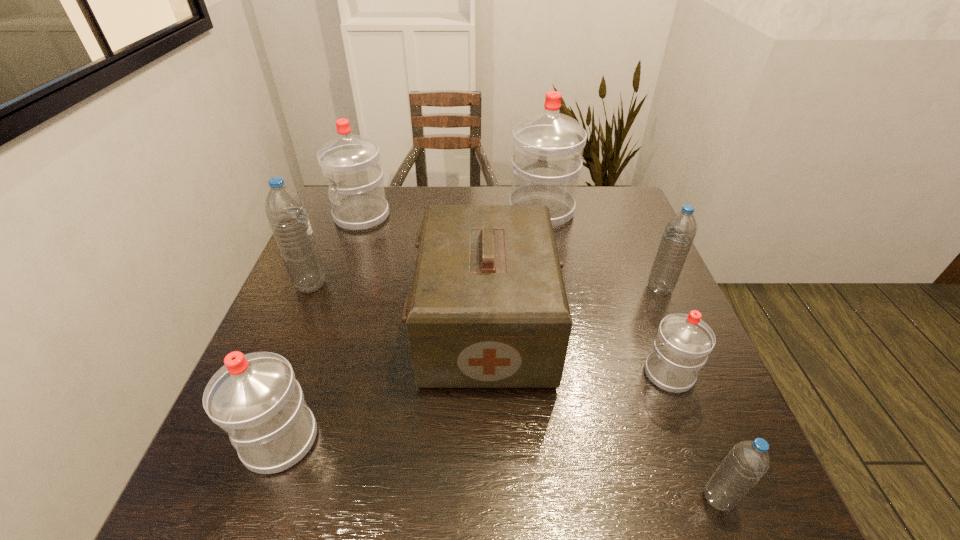
Locate an element on the screen. the second white water bottle from right to left is located at coordinates (548, 146).

Find the location of a particular element. This screenshot has height=540, width=960. the tallest water bottle is located at coordinates click(548, 146).

This screenshot has width=960, height=540. I want to click on the third smallest white water bottle, so click(x=351, y=163).

Find the location of a particular element. This screenshot has width=960, height=540. the biggest blue water bottle is located at coordinates (286, 213).

Where is `the first-aid kit`? the first-aid kit is located at coordinates (488, 308).

This screenshot has width=960, height=540. I want to click on the second smallest blue water bottle, so click(679, 233).

Where is `the nearest white water bottle`? This screenshot has height=540, width=960. the nearest white water bottle is located at coordinates (254, 398).

Find the location of a particular element. The image size is (960, 540). the second nearest object is located at coordinates (254, 398).

In order to click on the smallest white water bottle in this screenshot , I will do `click(683, 342)`.

Locate an element on the screen. the second nearest white water bottle is located at coordinates (683, 342).